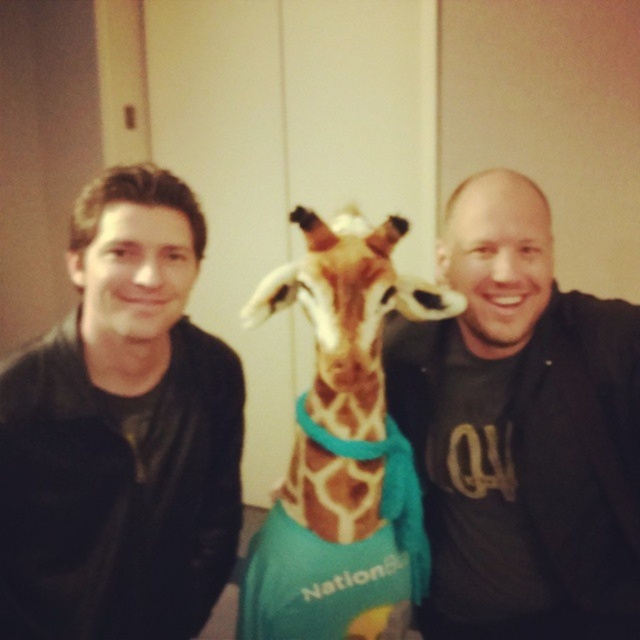
The image size is (640, 640). Describe the element at coordinates (122, 433) in the screenshot. I see `black leather jacket at left` at that location.

Is point (109, 467) in front of point (396, 220)?

No.

Locate an element on the screen. The width and height of the screenshot is (640, 640). black leather jacket at left is located at coordinates (122, 433).

In order to click on black leather jacket at left in this screenshot , I will do `click(122, 433)`.

Does matte black shirt at right have a smaller size compared to spotted fur giraffe at center?

Actually, matte black shirt at right might be larger than spotted fur giraffe at center.

Is matte black shirt at right to the right of spotted fur giraffe at center from the viewer's perspective?

Indeed, matte black shirt at right is positioned on the right side of spotted fur giraffe at center.

Does point (472, 556) lie in front of point (269, 275)?

Yes, point (472, 556) is in front of point (269, 275).

The width and height of the screenshot is (640, 640). In order to click on matte black shirt at right in this screenshot , I will do [x=522, y=432].

Between point (68, 625) and point (561, 593), which one is positioned in front?

Point (68, 625)

Is black leather jacket at left thinner than matte black shirt at right?

Correct, black leather jacket at left's width is less than matte black shirt at right's.

Image resolution: width=640 pixels, height=640 pixels. Identify the location of black leather jacket at left. (122, 433).